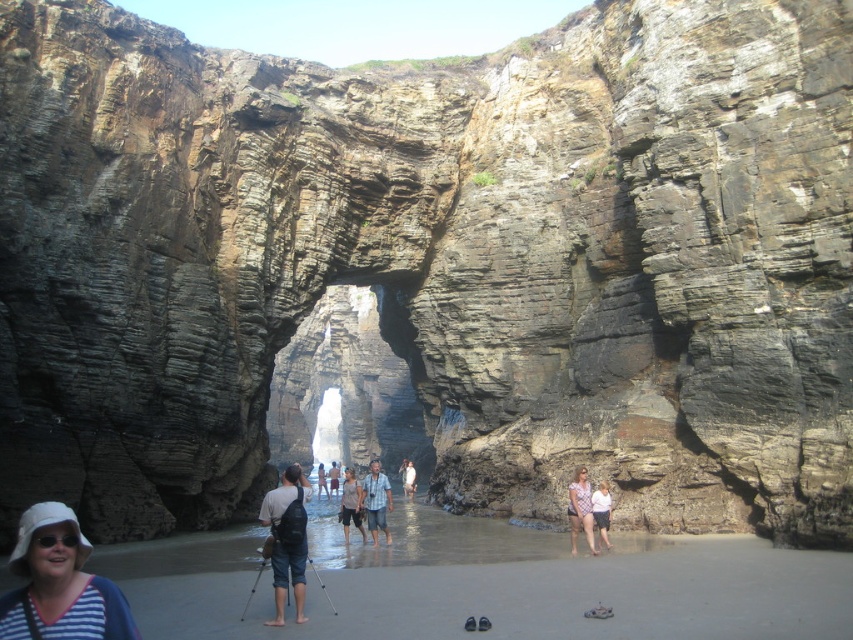
You are a photographer standing at the archway entrance. You want to take a photo that includes both the white fabric hat at lower left and the light pink fabric dress at center. Which object should you focus on first if you want to ensure both are in the frame?

You should focus on the white fabric hat at lower left first because it is wider than the light pink fabric dress at center, so it requires more space in the frame.

Looking at this image, you are a photographer standing at the base of the natural stone arch at center. You want to place your matte black backpack at center so that it is visible in your photo of the arch. Based on their positions, will the backpack be in the foreground or background of the photo?

The natural stone arch at center is above the matte black backpack at center, so when standing at the base of the arch, the backpack would be in the foreground of the photo since it is positioned closer to the camera than the arch.

You are standing at the point marked by the coordinates point (350,504). Looking towards the large rock archway in the background, which direction should you walk to reach it?

Since the point (350,504) represents the brown cotton shorts at center, you are currently at the center of the image. The large rock archway is further back, so you should walk forward to reach it.